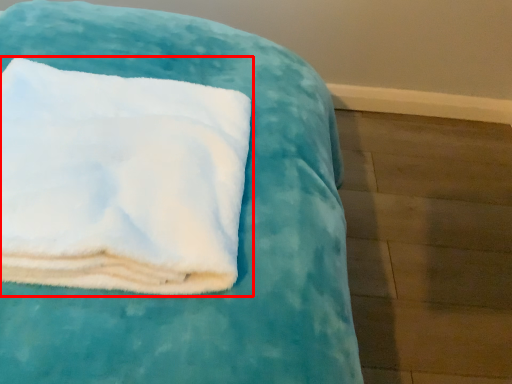
Question: In this image, where is towel (annotated by the red box) located relative to furniture?

Choices:
 (A) left
 (B) right

Answer: (A)